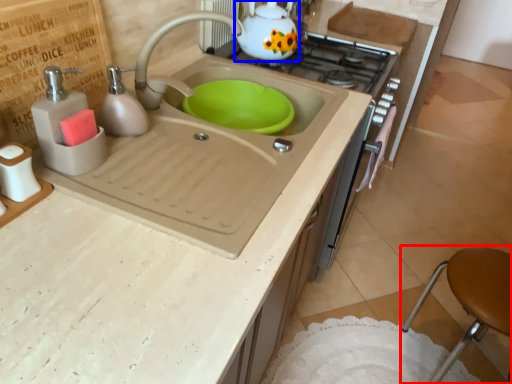
Question: Which object appears closest to the camera in this image, bar stool (highlighted by a red box) or tea pot (highlighted by a blue box)?

Choices:
 (A) bar stool
 (B) tea pot

Answer: (A)